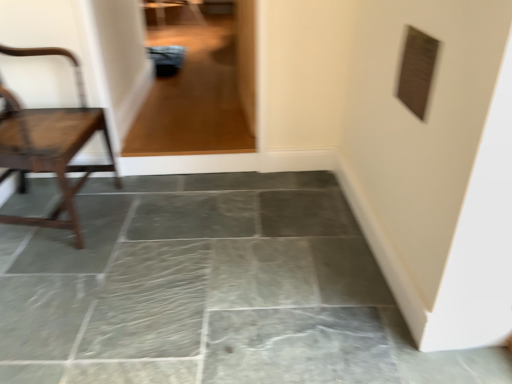
Identify the location of free spot to the right of wooden chair at left. (155, 221).